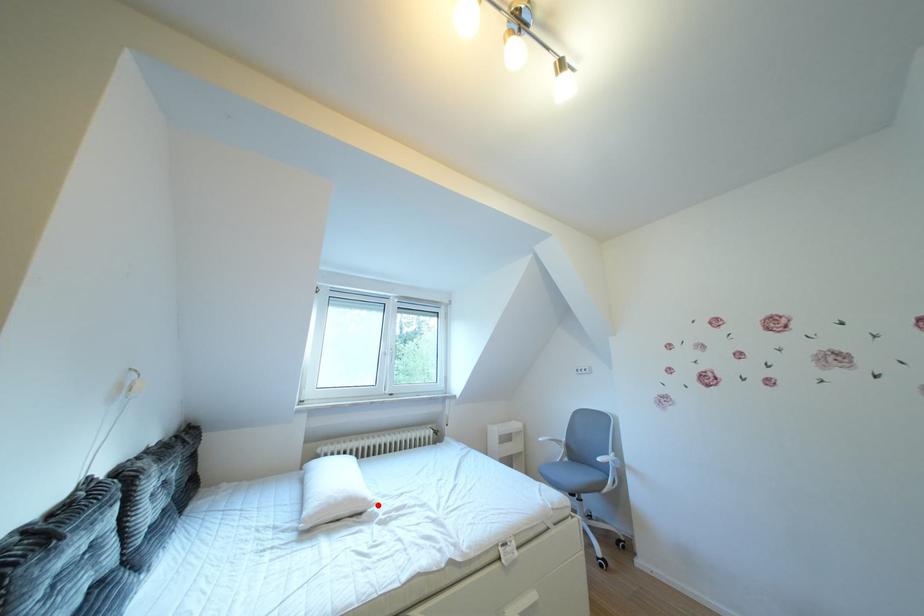
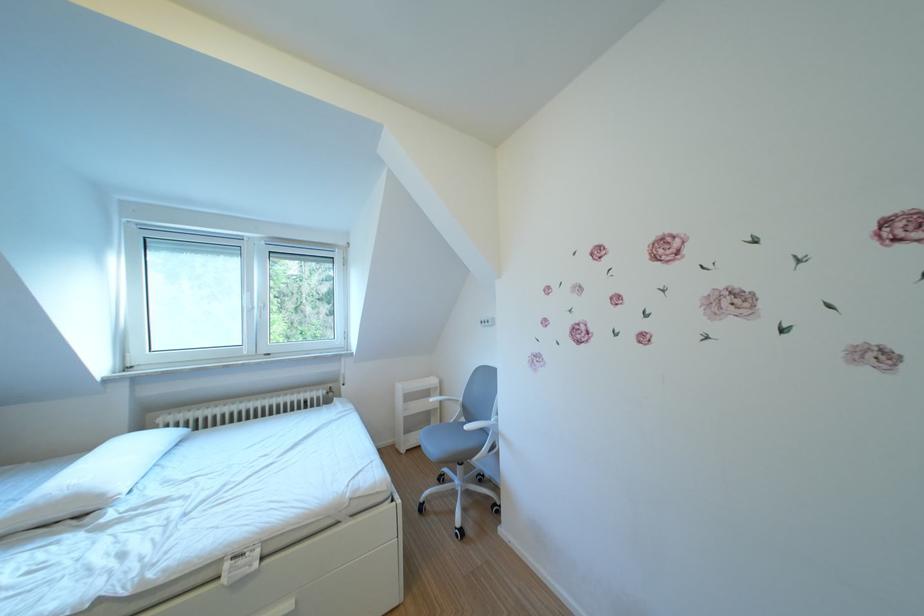
In the second image, find the point that corresponds to the highlighted location in the first image.

(115, 501)